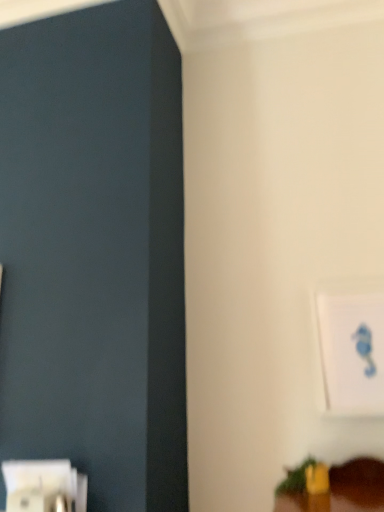
Describe the element at coordinates (351, 346) in the screenshot. This screenshot has height=512, width=384. I see `white paper seahorse at upper right` at that location.

Find the location of a particular element. white paper seahorse at upper right is located at coordinates (351, 346).

The width and height of the screenshot is (384, 512). Identify the location of white paper seahorse at upper right. (351, 346).